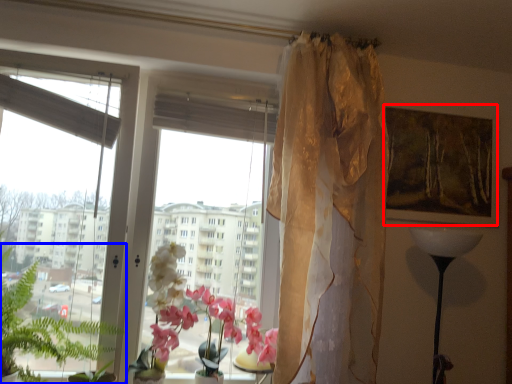
Question: Which object is closer to the camera taking this photo, picture frame (highlighted by a red box) or vegetation (highlighted by a blue box)?

Choices:
 (A) picture frame
 (B) vegetation

Answer: (B)